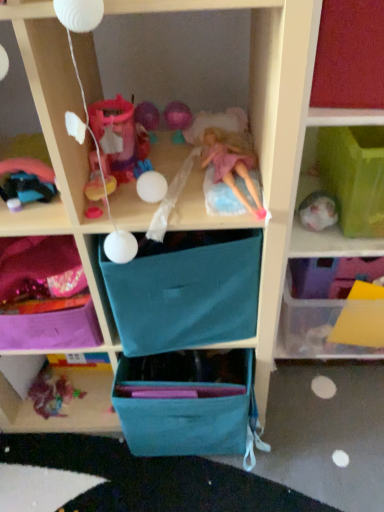
Question: From a real-world perspective, is multicolored fabric toy at lower left, which ranks as the first toy in bottom-to-top order, under translucent plastic container at right, which is the second shelf in left-to-right order?

Choices:
 (A) no
 (B) yes

Answer: (B)

Question: Is multicolored fabric toy at lower left, which ranks as the first toy in bottom-to-top order, positioned behind translucent plastic container at right, which is the second shelf in left-to-right order?

Choices:
 (A) yes
 (B) no

Answer: (A)

Question: Can you see multicolored fabric toy at lower left, which is counted as the 2th toy, starting from the top, touching translucent plastic container at right, which appears as the second shelf when viewed from the right?

Choices:
 (A) yes
 (B) no

Answer: (B)

Question: Does multicolored fabric toy at lower left, which appears as the second toy when viewed from the front, come in front of translucent plastic container at right, which is the second shelf in left-to-right order?

Choices:
 (A) yes
 (B) no

Answer: (B)

Question: Is multicolored fabric toy at lower left, which ranks as the first toy in bottom-to-top order, at the right side of translucent plastic container at right, which is the second shelf in left-to-right order?

Choices:
 (A) no
 (B) yes

Answer: (A)

Question: Considering the relative positions of multicolored fabric toy at lower left, which is counted as the 2th toy, starting from the top, and translucent plastic container at right, which appears as the second shelf when viewed from the right, in the image provided, is multicolored fabric toy at lower left, which is counted as the 2th toy, starting from the top, to the left of translucent plastic container at right, which appears as the second shelf when viewed from the right, from the viewer's perspective?

Choices:
 (A) no
 (B) yes

Answer: (B)

Question: From the image's perspective, is translucent plastic container at right beneath purple fabric bag at lower left, which appears as the 3th shelf when viewed from the right?

Choices:
 (A) yes
 (B) no

Answer: (B)

Question: Does translucent plastic container at right have a lesser width compared to purple fabric bag at lower left, arranged as the first shelf when viewed from the left?

Choices:
 (A) yes
 (B) no

Answer: (B)

Question: Is translucent plastic container at right closer to the viewer compared to purple fabric bag at lower left, which appears as the 3th shelf when viewed from the right?

Choices:
 (A) no
 (B) yes

Answer: (B)

Question: Is translucent plastic container at right next to purple fabric bag at lower left, arranged as the first shelf when viewed from the left, and touching it?

Choices:
 (A) no
 (B) yes

Answer: (A)

Question: Does translucent plastic container at right have a lesser height compared to purple fabric bag at lower left, arranged as the first shelf when viewed from the left?

Choices:
 (A) yes
 (B) no

Answer: (B)

Question: From a real-world perspective, is translucent plastic container at right under purple fabric bag at lower left, which appears as the 3th shelf when viewed from the right?

Choices:
 (A) yes
 (B) no

Answer: (B)

Question: Is teal fabric drawer at center, placed as the 1th drawer when sorted from top to bottom, not inside purple fabric bag at lower left, arranged as the first shelf when viewed from the left?

Choices:
 (A) no
 (B) yes

Answer: (B)